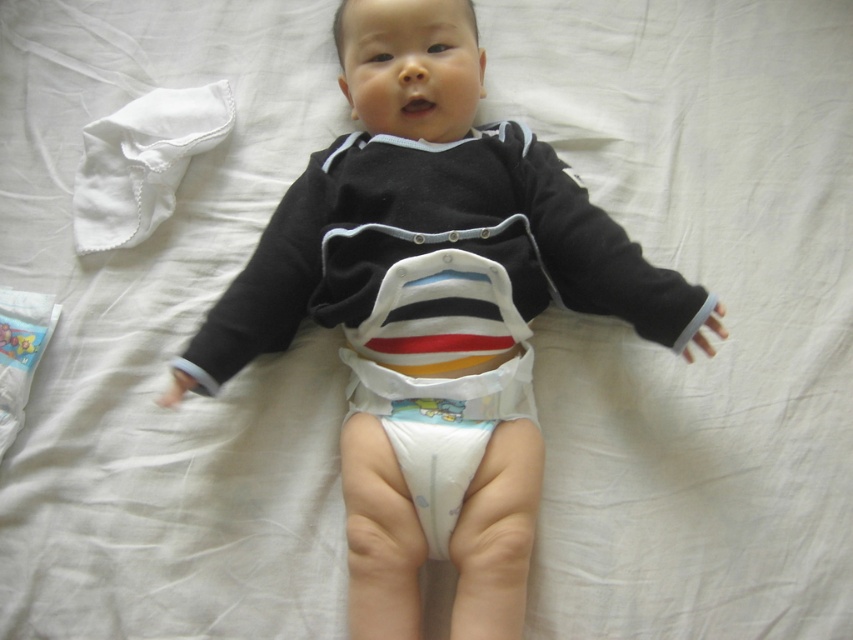
Question: Is soft cotton baby at center wider than white paper diaper at center?

Choices:
 (A) no
 (B) yes

Answer: (B)

Question: Among these points, which one is nearest to the camera?

Choices:
 (A) (689, 296)
 (B) (364, 381)

Answer: (A)

Question: Among these objects, which one is farthest from the camera?

Choices:
 (A) soft cotton baby at center
 (B) white paper diaper at center

Answer: (B)

Question: Which of the following is the farthest from the observer?

Choices:
 (A) soft cotton baby at center
 (B) white paper diaper at center

Answer: (B)

Question: Can you confirm if soft cotton baby at center is positioned to the left of white paper diaper at center?

Choices:
 (A) no
 (B) yes

Answer: (A)

Question: Where is soft cotton baby at center located in relation to white paper diaper at center in the image?

Choices:
 (A) left
 (B) right

Answer: (B)